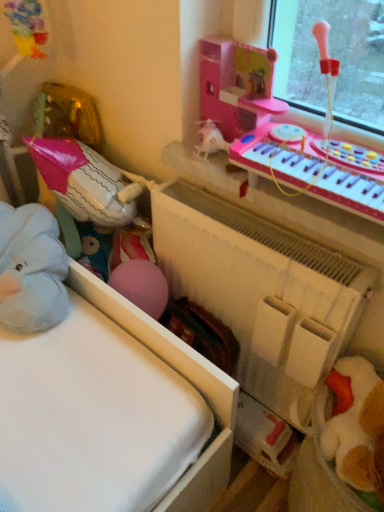
Locate an element on the screen. This screenshot has height=512, width=384. blank space situated above white matte radiator at center (from a real-world perspective) is located at coordinates (225, 218).